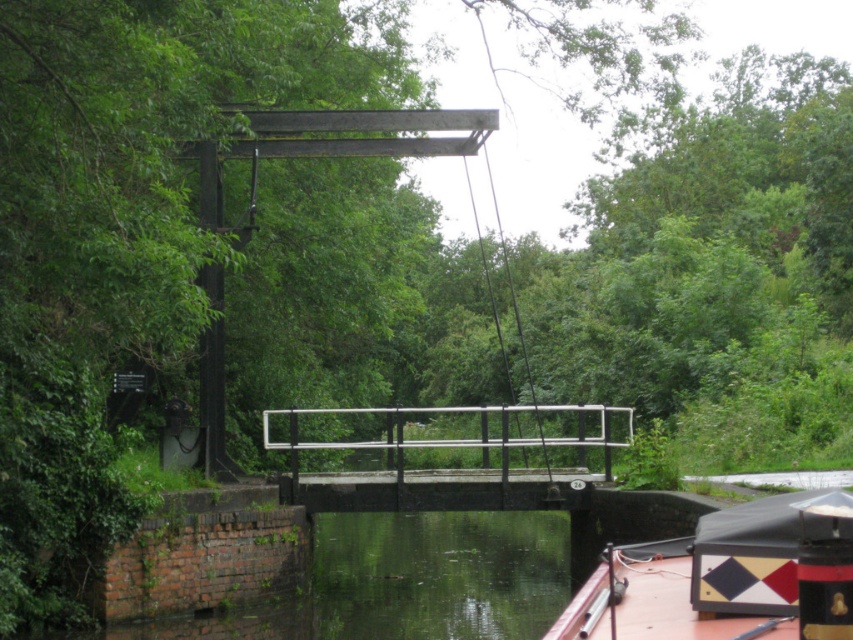
Question: In this image, where is green reflective water at lower center located relative to red plastic boat at lower right?

Choices:
 (A) left
 (B) right

Answer: (A)

Question: Which point is closer to the camera?

Choices:
 (A) green reflective water at lower center
 (B) red plastic boat at lower right

Answer: (B)

Question: Does green reflective water at lower center lie behind red plastic boat at lower right?

Choices:
 (A) yes
 (B) no

Answer: (A)

Question: Can you confirm if red plastic boat at lower right is bigger than white metal rail at center?

Choices:
 (A) no
 (B) yes

Answer: (A)

Question: Which of the following is the closest to the observer?

Choices:
 (A) red plastic boat at lower right
 (B) white metal rail at center

Answer: (A)

Question: Which of the following is the farthest from the observer?

Choices:
 (A) green reflective water at lower center
 (B) white metal rail at center
 (C) red plastic boat at lower right

Answer: (B)